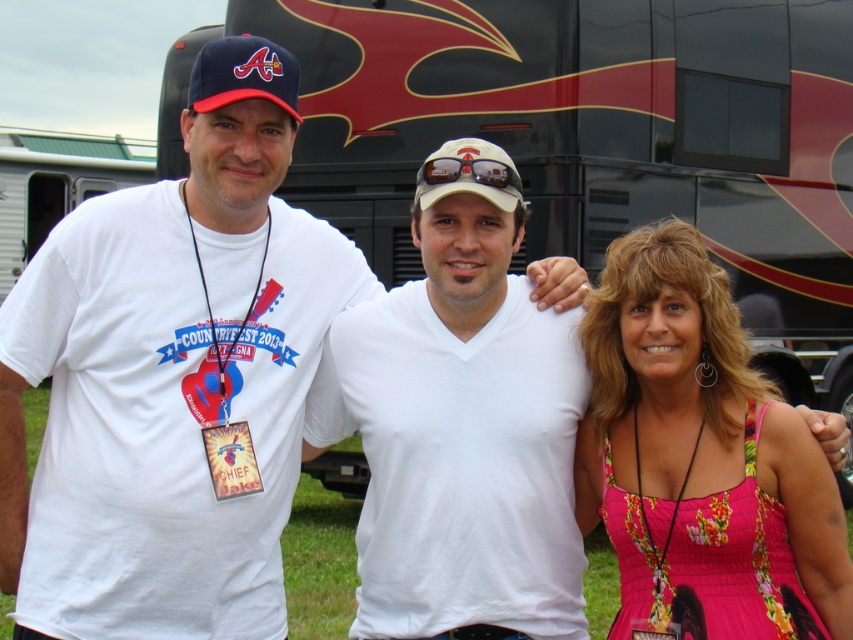
Question: Can you confirm if white matte shirt at center is smaller than floral print dress at center?

Choices:
 (A) no
 (B) yes

Answer: (A)

Question: Which point is closer to the camera?

Choices:
 (A) (457, 573)
 (B) (714, 141)

Answer: (A)

Question: Where is matte blue baseball cap at upper left located in relation to white matte baseball cap at center in the image?

Choices:
 (A) left
 (B) right

Answer: (A)

Question: Is matte blue baseball cap at upper left positioned behind white matte baseball cap at center?

Choices:
 (A) no
 (B) yes

Answer: (A)

Question: Which point is closer to the camera taking this photo?

Choices:
 (A) (514, 552)
 (B) (202, 93)
 (C) (438, 195)

Answer: (B)

Question: Based on their relative distances, which object is nearer to the white matte baseball cap at center?

Choices:
 (A) black glossy recreational vehicle at upper center
 (B) floral print dress at center
 (C) matte blue baseball cap at upper left
 (D) white matte shirt at center

Answer: (D)